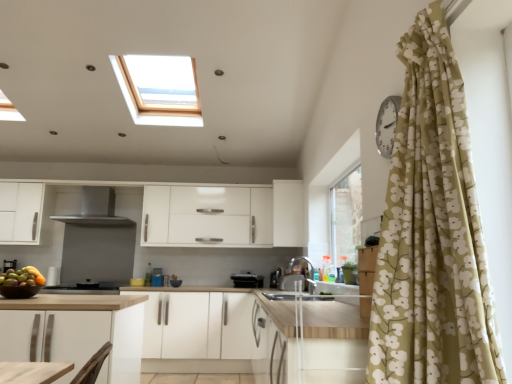
Question: From a real-world perspective, is shiny brown bowl of fruits at lower left on top of white matte cabinet at center, acting as the 2th cabinetry starting from the bottom?

Choices:
 (A) no
 (B) yes

Answer: (A)

Question: Is shiny brown bowl of fruits at lower left not inside white matte cabinet at center, which is counted as the first cabinetry, starting from the top?

Choices:
 (A) yes
 (B) no

Answer: (A)

Question: Does shiny brown bowl of fruits at lower left have a greater height compared to white matte cabinet at center, acting as the 2th cabinetry starting from the bottom?

Choices:
 (A) yes
 (B) no

Answer: (B)

Question: Does shiny brown bowl of fruits at lower left appear on the left side of white matte cabinet at center, which is counted as the first cabinetry, starting from the top?

Choices:
 (A) no
 (B) yes

Answer: (B)

Question: From the image's perspective, is shiny brown bowl of fruits at lower left above white matte cabinet at center, marked as the second cabinetry in a left-to-right arrangement?

Choices:
 (A) no
 (B) yes

Answer: (A)

Question: Is shiny brown bowl of fruits at lower left oriented towards white matte cabinet at center, acting as the 2th cabinetry starting from the bottom?

Choices:
 (A) no
 (B) yes

Answer: (A)

Question: Does white matte cabinet at center, the second cabinetry viewed from the top, come behind satin black coffee machine at lower left?

Choices:
 (A) no
 (B) yes

Answer: (A)

Question: From the image's perspective, is white matte cabinet at center, which is counted as the 2th cabinetry, starting from the right, over satin black coffee machine at lower left?

Choices:
 (A) no
 (B) yes

Answer: (A)

Question: Is white matte cabinet at center, the second cabinetry viewed from the top, at the right side of satin black coffee machine at lower left?

Choices:
 (A) yes
 (B) no

Answer: (A)

Question: Does white matte cabinet at center, positioned as the 1th cabinetry in bottom-to-top order, turn towards satin black coffee machine at lower left?

Choices:
 (A) yes
 (B) no

Answer: (B)

Question: Can you confirm if white matte cabinet at center, the second cabinetry viewed from the top, is wider than satin black coffee machine at lower left?

Choices:
 (A) yes
 (B) no

Answer: (A)

Question: Is white matte cabinet at center, placed as the 1th cabinetry when sorted from left to right, not close to satin black coffee machine at lower left?

Choices:
 (A) yes
 (B) no

Answer: (A)

Question: Considering the relative sizes of satin black coffee machine at lower left and satin black toaster at center, which is the fourth appliance in right-to-left order, in the image provided, is satin black coffee machine at lower left bigger than satin black toaster at center, which is the fourth appliance in right-to-left order,?

Choices:
 (A) no
 (B) yes

Answer: (B)